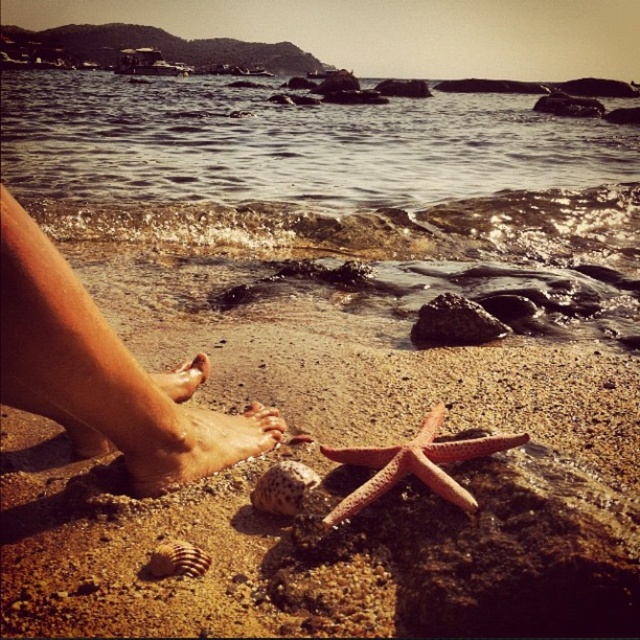
Is sandy brown at lower center smaller than speckled shell at lower center?

No, sandy brown at lower center is not smaller than speckled shell at lower center.

Can you confirm if sandy brown at lower center is positioned below speckled shell at lower center?

Incorrect, sandy brown at lower center is not positioned below speckled shell at lower center.

Is point (323, 612) farther from camera compared to point (284, 513)?

No, it is not.

I want to click on sandy brown at lower center, so click(x=340, y=488).

Is sandy brown at lower center closer to camera compared to dry skin at center?

That is True.

How much distance is there between sandy brown at lower center and dry skin at center?

Answer: They are 12.28 inches apart.

Find the location of `sandy brown at lower center`. sandy brown at lower center is located at coordinates click(340, 488).

Is black rock at center bigger than brown skin at lower left?

Actually, black rock at center might be smaller than brown skin at lower left.

Does black rock at center come behind brown skin at lower left?

Yes, it is.

Measure the distance between point (449, 300) and camera.

Point (449, 300) is 7.39 feet away from camera.

Image resolution: width=640 pixels, height=640 pixels. Find the location of `black rock at center`. black rock at center is located at coordinates (454, 323).